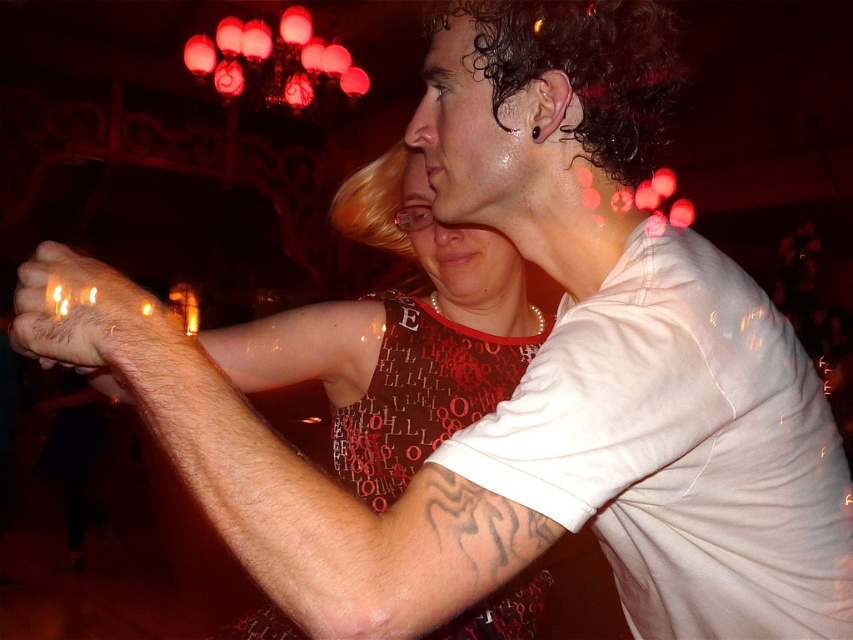
Based on the scene description, where is the hair at center located in the image?

The hair at center is located at point (x=183, y=337).

You are at a party and notice two people dancing closely. You see hair at center and hairy skin at center. Which one is positioned to the right of the other?

The hair at center is positioned to the right of the hairy skin at center.

You are a photographer at a party and want to capture a closeup shot of the hair at center and the hairy skin at center. Based on their sizes, which one should you focus on to ensure it fills the frame more?

The hair at center has a larger size compared to the hairy skin at center, so focusing on the hair at center will fill the frame more.